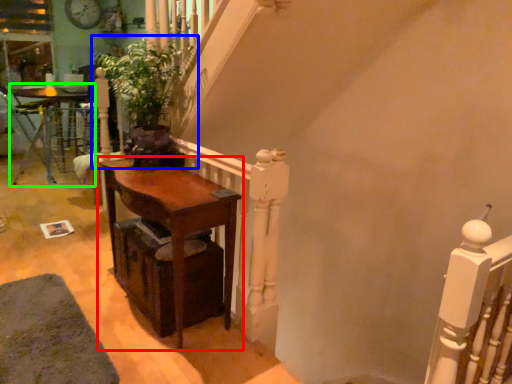
Question: Which is nearer to the table (highlighted by a red box)? houseplant (highlighted by a blue box) or table (highlighted by a green box).

Choices:
 (A) houseplant
 (B) table

Answer: (A)